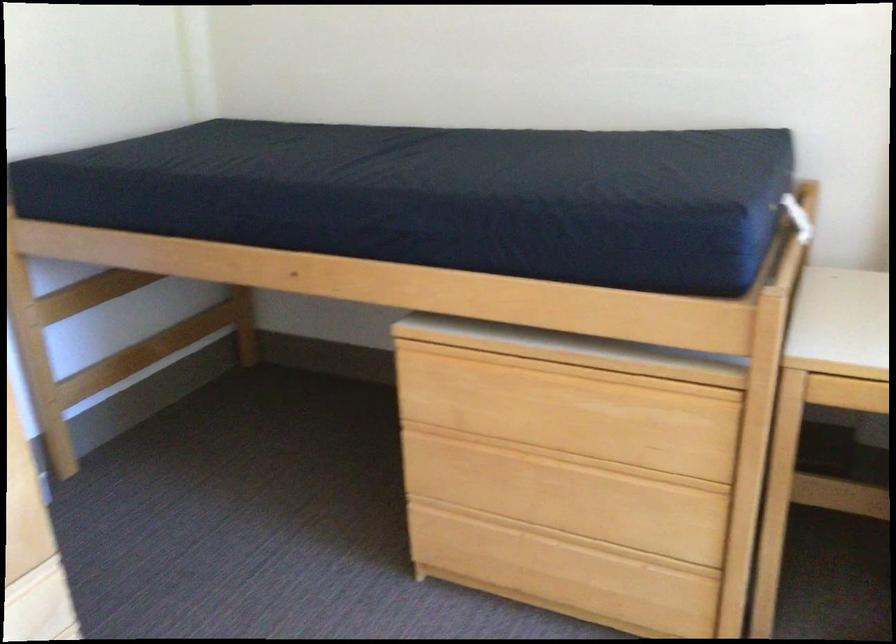
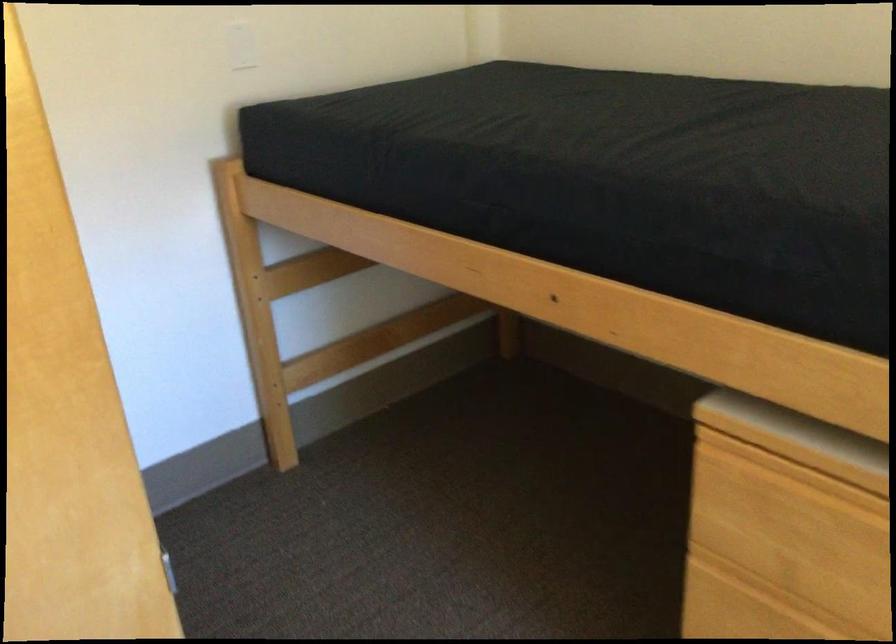
In the second image, find the point that corresponds to pixel 483 353 in the first image.

(837, 474)